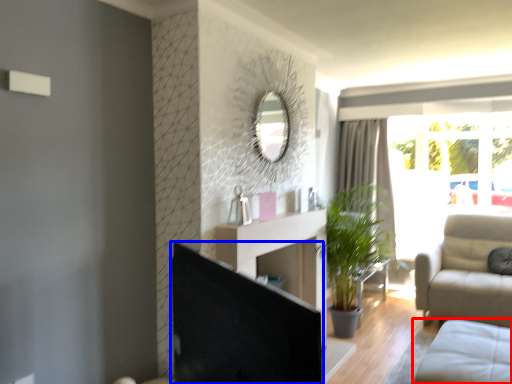
Question: Among these objects, which one is farthest to the camera, studio couch (highlighted by a red box) or screen door (highlighted by a blue box)?

Choices:
 (A) studio couch
 (B) screen door

Answer: (A)